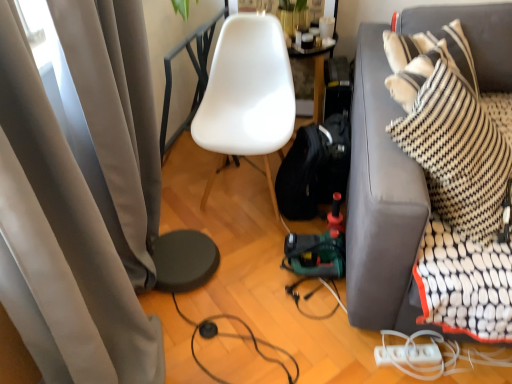
The image size is (512, 384). Describe the element at coordinates (247, 95) in the screenshot. I see `white matte chair at center` at that location.

This screenshot has height=384, width=512. What do you see at coordinates (432, 355) in the screenshot? I see `white plastic power strip at lower right, which is the 2th cable from left to right` at bounding box center [432, 355].

In order to click on white plastic power strip at lower right, which is the 2th cable from left to right in this screenshot , I will do `click(432, 355)`.

This screenshot has height=384, width=512. In order to click on black rubber cable at lower center, the second cable viewed from the right in this screenshot , I will do `click(231, 336)`.

Identify the location of white matte chair at center. Image resolution: width=512 pixels, height=384 pixels. (247, 95).

From the image's perspective, does white plastic extension cord at lower right appear lower than white matte chair at center?

Yes, from the image's perspective, white plastic extension cord at lower right is below white matte chair at center.

Considering the relative sizes of white plastic extension cord at lower right and white matte chair at center in the image provided, is white plastic extension cord at lower right bigger than white matte chair at center?

Incorrect, white plastic extension cord at lower right is not larger than white matte chair at center.

Identify the location of chair lying above the white plastic extension cord at lower right (from the image's perspective). (247, 95).

Looking at their sizes, would you say dark gray fabric couch at right is wider or thinner than white plastic extension cord at lower right?

In the image, dark gray fabric couch at right appears to be wider than white plastic extension cord at lower right.

Does dark gray fabric couch at right have a greater height compared to white plastic extension cord at lower right?

Correct, dark gray fabric couch at right is much taller as white plastic extension cord at lower right.

From a real-world perspective, is dark gray fabric couch at right physically located above or below white plastic extension cord at lower right?

dark gray fabric couch at right is situated higher than white plastic extension cord at lower right in the real world.

Visually, is white plastic power strip at lower right, which is the 2th cable from left to right, positioned to the left or to the right of matte gray curtain at left?

In the image, white plastic power strip at lower right, which is the 2th cable from left to right, appears on the right side of matte gray curtain at left.

From their relative heights in the image, would you say white plastic power strip at lower right, which is the 2th cable from left to right, is taller or shorter than matte gray curtain at left?

white plastic power strip at lower right, which is the 2th cable from left to right, is shorter than matte gray curtain at left.

At what (x,y) coordinates should I click in order to perform the action: click on curtain that is in front of the white plastic power strip at lower right, which is counted as the 1th cable, starting from the right. Please return your answer as a coordinate pair (x, y). Looking at the image, I should click on (80, 194).

Is point (473, 357) more distant than point (94, 203)?

Yes, point (473, 357) is farther from viewer.

Looking at this image, are white plastic power strip at lower right, which is counted as the 1th cable, starting from the right, and white plastic extension cord at lower right located far from each other?

No, white plastic power strip at lower right, which is counted as the 1th cable, starting from the right, is not far from white plastic extension cord at lower right.

Considering the sizes of objects white plastic power strip at lower right, which is the 2th cable from left to right, and white plastic extension cord at lower right in the image provided, who is smaller, white plastic power strip at lower right, which is the 2th cable from left to right, or white plastic extension cord at lower right?

white plastic extension cord at lower right is smaller.

From a real-world perspective, which is physically above, black rubber cable at lower center, the second cable viewed from the right, or matte gray curtain at left?

matte gray curtain at left.

How many degrees apart are the facing directions of black rubber cable at lower center, the second cable viewed from the right, and matte gray curtain at left?

The angular difference between black rubber cable at lower center, the second cable viewed from the right, and matte gray curtain at left is 0.646 degrees.

Considering the relative sizes of black rubber cable at lower center, marked as the 1th cable in a left-to-right arrangement, and matte gray curtain at left in the image provided, is black rubber cable at lower center, marked as the 1th cable in a left-to-right arrangement, wider than matte gray curtain at left?

Yes, black rubber cable at lower center, marked as the 1th cable in a left-to-right arrangement, is wider than matte gray curtain at left.

Identify the location of the 2nd cable behind the matte gray curtain at left. This screenshot has width=512, height=384. (231, 336).

Is there a large distance between dark gray fabric couch at right and matte gray curtain at left?

dark gray fabric couch at right is actually quite close to matte gray curtain at left.

What's the angular difference between dark gray fabric couch at right and matte gray curtain at left's facing directions?

There is a 87.6-degree angle between the facing directions of dark gray fabric couch at right and matte gray curtain at left.

From the image's perspective, which one is positioned lower, dark gray fabric couch at right or matte gray curtain at left?

matte gray curtain at left.

Is matte gray curtain at left inside dark gray fabric couch at right?

No.

From a real-world perspective, is white plastic extension cord at lower right positioned under dark gray fabric couch at right based on gravity?

Correct, in the physical world, white plastic extension cord at lower right is lower than dark gray fabric couch at right.

Between white plastic extension cord at lower right and dark gray fabric couch at right, which one is positioned behind?

white plastic extension cord at lower right.

How much distance is there between white plastic extension cord at lower right and dark gray fabric couch at right?

The distance of white plastic extension cord at lower right from dark gray fabric couch at right is 25.62 inches.

Does white plastic extension cord at lower right have a larger size compared to dark gray fabric couch at right?

No, white plastic extension cord at lower right is not bigger than dark gray fabric couch at right.

I want to click on extension cord in front of the white matte chair at center, so click(x=424, y=354).

I want to click on studio couch above the white plastic extension cord at lower right (from a real-world perspective), so click(381, 201).

Looking at this image, which object lies nearer to the anchor point white matte chair at center, black rubber cable at lower center, marked as the 1th cable in a left-to-right arrangement, or matte gray curtain at left?

Based on the image, black rubber cable at lower center, marked as the 1th cable in a left-to-right arrangement, appears to be nearer to white matte chair at center.

Looking at the image, which one is located further to black rubber cable at lower center, marked as the 1th cable in a left-to-right arrangement, white plastic extension cord at lower right or matte gray curtain at left?

matte gray curtain at left.

Considering their positions, is white plastic power strip at lower right, which is counted as the 1th cable, starting from the right, positioned closer to matte gray curtain at left than black rubber cable at lower center, marked as the 1th cable in a left-to-right arrangement?

black rubber cable at lower center, marked as the 1th cable in a left-to-right arrangement.

Considering their positions, is white matte chair at center positioned further to matte gray curtain at left than white plastic power strip at lower right, which is counted as the 1th cable, starting from the right?

The object further to matte gray curtain at left is white matte chair at center.

From the picture: Considering their positions, is dark gray fabric couch at right positioned closer to white plastic extension cord at lower right than white matte chair at center?

dark gray fabric couch at right.

Which object lies nearer to the anchor point dark gray fabric couch at right, white plastic power strip at lower right, which is the 2th cable from left to right, or black rubber cable at lower center, the second cable viewed from the right?

white plastic power strip at lower right, which is the 2th cable from left to right.

Which object lies further to the anchor point white matte chair at center, white plastic power strip at lower right, which is the 2th cable from left to right, or matte gray curtain at left?

white plastic power strip at lower right, which is the 2th cable from left to right.

Looking at the image, which one is located closer to black rubber cable at lower center, the second cable viewed from the right, matte gray curtain at left or white plastic power strip at lower right, which is the 2th cable from left to right?

The object closer to black rubber cable at lower center, the second cable viewed from the right, is white plastic power strip at lower right, which is the 2th cable from left to right.

Locate an element on the screen. studio couch between white matte chair at center and white plastic extension cord at lower right vertically is located at coordinates (381, 201).

The width and height of the screenshot is (512, 384). Find the location of `chair between matte gray curtain at left and dark gray fabric couch at right in the horizontal direction`. chair between matte gray curtain at left and dark gray fabric couch at right in the horizontal direction is located at coordinates (247, 95).

Where is `extension cord between dark gray fabric couch at right and white plastic power strip at lower right, which is the 2th cable from left to right, vertically`? This screenshot has width=512, height=384. extension cord between dark gray fabric couch at right and white plastic power strip at lower right, which is the 2th cable from left to right, vertically is located at coordinates (424, 354).

You are a GUI agent. You are given a task and a screenshot of the screen. Output one action in this format:
    pyautogui.click(x=<x>, y=<y>)
    Task: Click on the cable between white matte chair at center and dark gray fabric couch at right from left to right
    The image size is (512, 384).
    Given the screenshot: What is the action you would take?
    pyautogui.click(x=432, y=355)